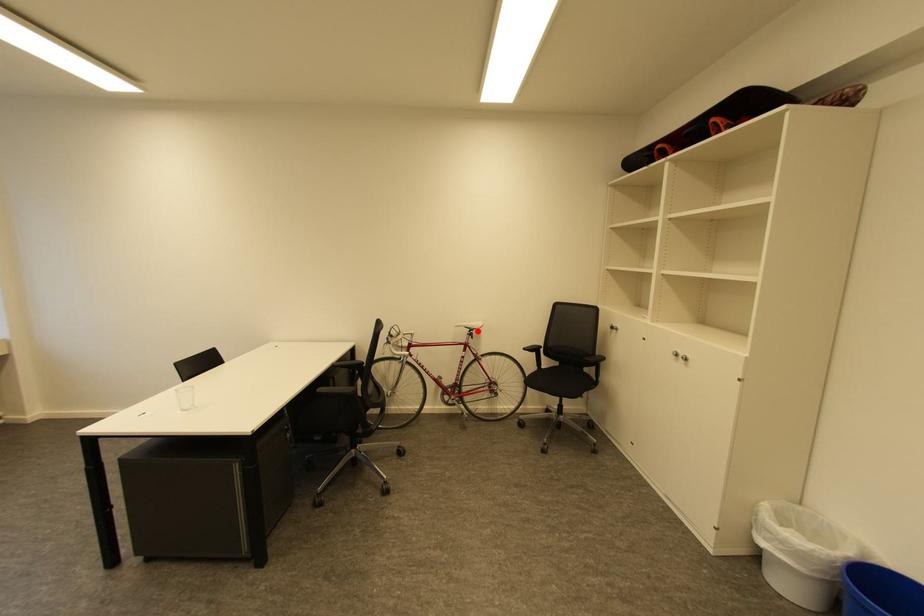
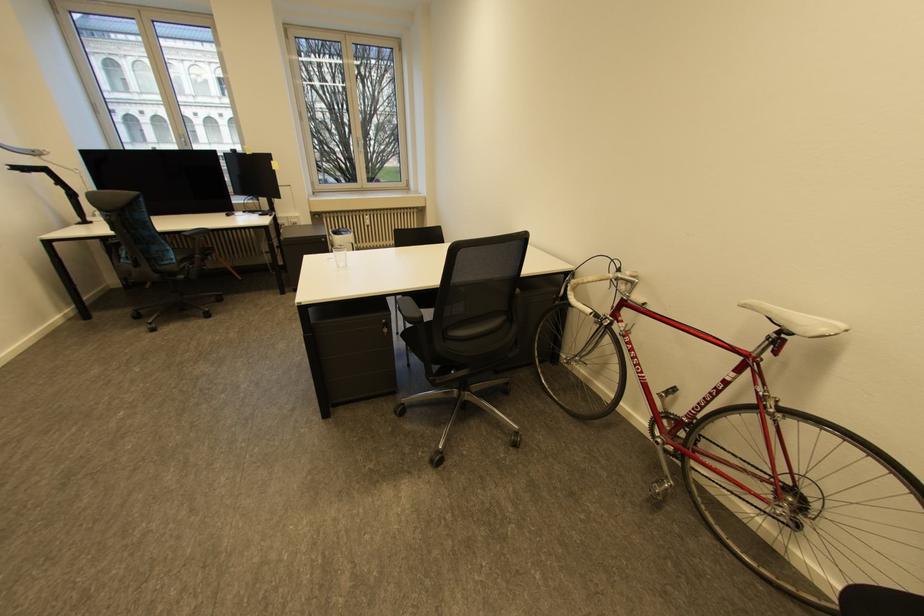
Find the pixel in the second image that matches the highlighted location in the first image.

(789, 331)